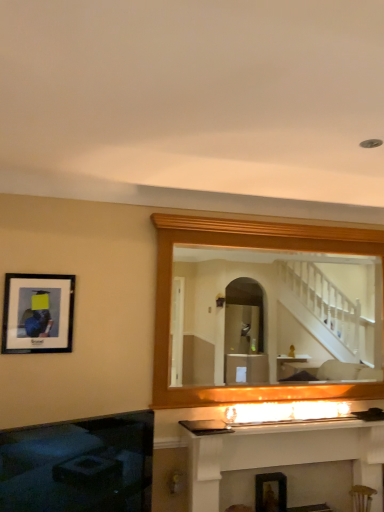
Question: Looking at the image, does white glossy fireplace at center, which is the second fireplace from left to right, seem bigger or smaller compared to black glass fireplace at lower left, the 2th fireplace viewed from the right?

Choices:
 (A) big
 (B) small

Answer: (A)

Question: Visually, is white glossy fireplace at center, positioned as the first fireplace in right-to-left order, positioned to the left or to the right of black glass fireplace at lower left, the 2th fireplace viewed from the right?

Choices:
 (A) left
 (B) right

Answer: (B)

Question: Which object is the closest to the black glass fireplace at lower left, which ranks as the first fireplace in left-to-right order?

Choices:
 (A) wooden mirror at upper center
 (B) matte black picture frame at left
 (C) white glossy fireplace at center, positioned as the first fireplace in right-to-left order

Answer: (B)

Question: Which object is the farthest from the black glass fireplace at lower left, which ranks as the first fireplace in left-to-right order?

Choices:
 (A) white glossy fireplace at center, which is the second fireplace from left to right
 (B) wooden mirror at upper center
 (C) matte black picture frame at left

Answer: (B)